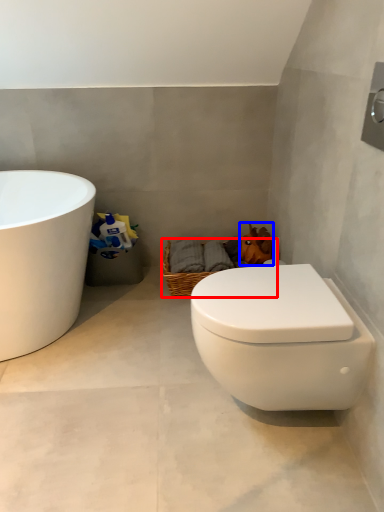
Question: Which point is further to the camera, basket (highlighted by a red box) or animal (highlighted by a blue box)?

Choices:
 (A) basket
 (B) animal

Answer: (A)